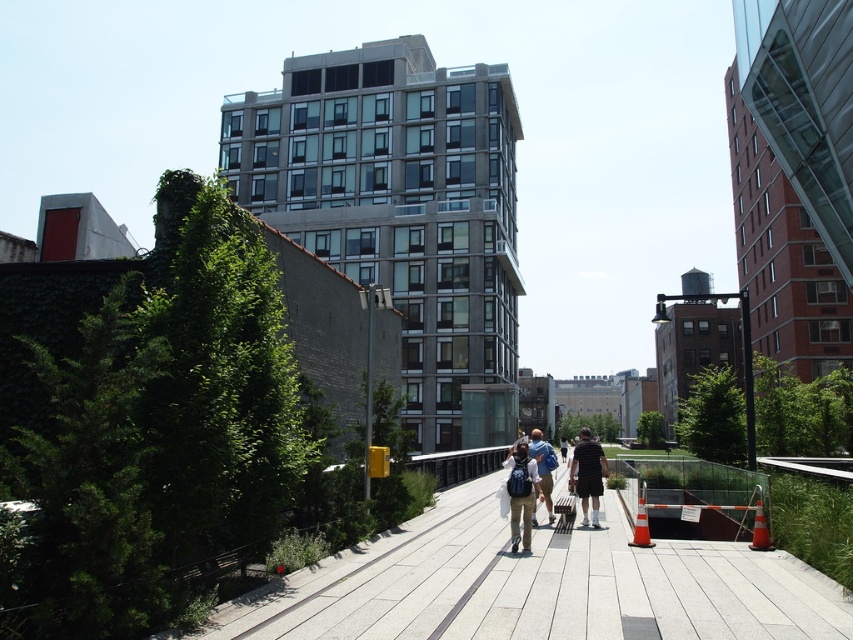
You are a photographer standing in the urban scene and want to take a photo that includes both the matte gray backpacks at center and the dark gray shorts at center. Based on their positions, which object should appear closer to the camera in the photo?

The matte gray backpacks at center should appear closer to the camera because it is in front of the dark gray shorts at center.

You are standing in the urban scene and notice two items at the center of the image. Which item is positioned higher from the ground, the matte gray backpacks at center or the dark gray shorts at center?

The matte gray backpacks at center is located above the dark gray shorts at center, so the matte gray backpacks at center is positioned higher from the ground.

You are standing in the urban scene and need to place a matte gray backpacks at center and dark gray shorts at center side by side on a narrow shelf. Which object should you place first to ensure they both fit?

You should place the dark gray shorts at center first because the matte gray backpacks at center might be wider and require more space, so placing the wider item first ensures both can fit on the narrow shelf.